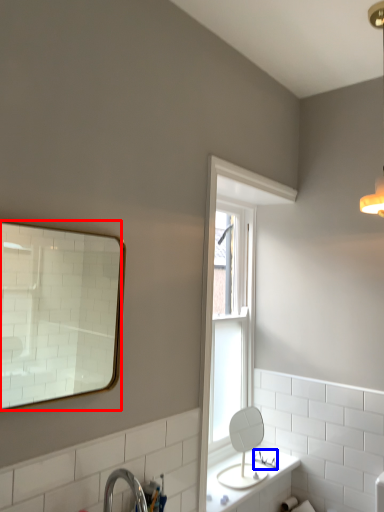
Question: Which object appears farthest to the camera in this image, mirror (highlighted by a red box) or plumbing fixture (highlighted by a blue box)?

Choices:
 (A) mirror
 (B) plumbing fixture

Answer: (B)